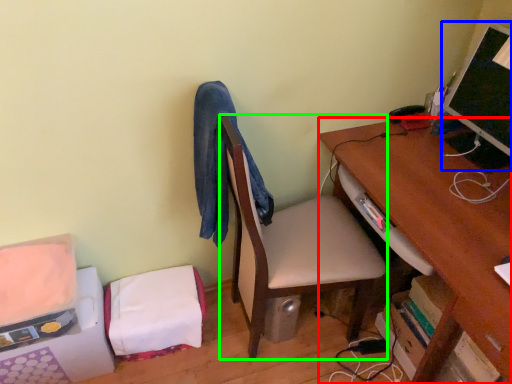
Question: Estimate the real-world distances between objects in this image. Which object is closer to desk (highlighted by a red box), computer monitor (highlighted by a blue box) or table (highlighted by a green box)?

Choices:
 (A) computer monitor
 (B) table

Answer: (A)